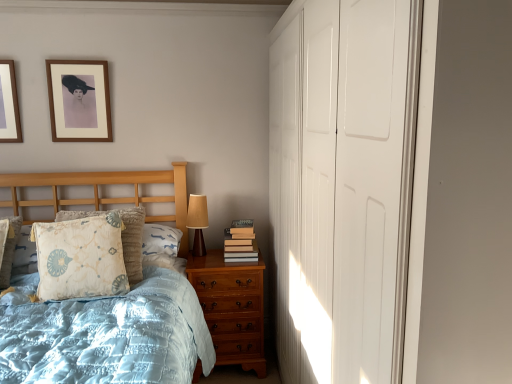
At what (x,y) coordinates should I click in order to perform the action: click on hardcover books at right. Please return your answer as a coordinate pair (x, y). Looking at the image, I should click on (240, 242).

The width and height of the screenshot is (512, 384). In order to click on matte wood picture frame at upper left, which is counted as the second picture frame, starting from the right in this screenshot , I will do `click(9, 105)`.

Consider the image. What is the approximate height of white glossy closet doors at right?

white glossy closet doors at right is 1.96 meters in height.

This screenshot has width=512, height=384. Identify the location of wooden picture frame at upper left, arranged as the 2th picture frame when viewed from the left. (79, 101).

What is the approximate height of floral-patterned fabric pillow at left?

The height of floral-patterned fabric pillow at left is 19.31 inches.

You are a GUI agent. You are given a task and a screenshot of the screen. Output one action in this format:
    pyautogui.click(x=<x>, y=<y>)
    Task: Click on the floral-patterned fabric pillow at left
    This screenshot has width=512, height=384.
    Given the screenshot: What is the action you would take?
    pyautogui.click(x=80, y=258)

Identify the location of hardcover books at right. (240, 242).

From a real-world perspective, between white glossy closet doors at right and hardcover books at right, who is vertically lower?

In real-world perspective, hardcover books at right is lower.

Which object is closer to the camera, white glossy closet doors at right or hardcover books at right?

white glossy closet doors at right is closer to the camera.

Would you say white glossy closet doors at right is a long distance from hardcover books at right?

That's right, there is a large distance between white glossy closet doors at right and hardcover books at right.

Can you confirm if white glossy closet doors at right is shorter than hardcover books at right?

Incorrect, the height of white glossy closet doors at right does not fall short of that of hardcover books at right.

Is light brown wood chest of drawers at lower right bigger or smaller than white glossy closet doors at right?

Considering their sizes, light brown wood chest of drawers at lower right takes up less space than white glossy closet doors at right.

Considering the relative positions of light brown wood chest of drawers at lower right and white glossy closet doors at right in the image provided, is light brown wood chest of drawers at lower right to the left or to the right of white glossy closet doors at right?

From the image, it's evident that light brown wood chest of drawers at lower right is to the left of white glossy closet doors at right.

Are light brown wood chest of drawers at lower right and white glossy closet doors at right beside each other?

No, light brown wood chest of drawers at lower right is not making contact with white glossy closet doors at right.

Which object is closer to the camera taking this photo, white glossy closet doors at right or wooden picture frame at upper left, the first picture frame from the right?

white glossy closet doors at right is more forward.

What's the angular difference between white glossy closet doors at right and wooden picture frame at upper left, the first picture frame from the right,'s facing directions?

→ There is a 90.7-degree angle between the facing directions of white glossy closet doors at right and wooden picture frame at upper left, the first picture frame from the right.

Is white glossy closet doors at right looking in the opposite direction of wooden picture frame at upper left, arranged as the 2th picture frame when viewed from the left?

No, wooden picture frame at upper left, arranged as the 2th picture frame when viewed from the left, is not at the back of white glossy closet doors at right.

From the image's perspective, would you say white glossy closet doors at right is shown under wooden picture frame at upper left, the first picture frame from the right?

Correct, white glossy closet doors at right appears lower than wooden picture frame at upper left, the first picture frame from the right, in the image.

Considering the sizes of white glossy closet doors at right and light blue quilted bed at left in the image, is white glossy closet doors at right bigger or smaller than light blue quilted bed at left?

white glossy closet doors at right is smaller than light blue quilted bed at left.

In the image, there is a light blue quilted bed at left. In order to click on door above it (from the image's perspective) in this screenshot , I will do `click(343, 182)`.

Consider the image. In the image, is white glossy closet doors at right on the left side or the right side of light blue quilted bed at left?

Clearly, white glossy closet doors at right is on the right of light blue quilted bed at left in the image.

Based on the photo, measure the distance from white glossy closet doors at right to light blue quilted bed at left.

A distance of 1.27 meters exists between white glossy closet doors at right and light blue quilted bed at left.

How many degrees apart are the facing directions of wooden picture frame at upper left, arranged as the 2th picture frame when viewed from the left, and light blue quilted bed at left?

1.45e-05 degrees.

Locate an element on the screen. This screenshot has width=512, height=384. bed below the wooden picture frame at upper left, the first picture frame from the right (from the image's perspective) is located at coordinates (106, 198).

From a real-world perspective, is wooden picture frame at upper left, the first picture frame from the right, above or below light blue quilted bed at left?

In terms of real-world spatial position, wooden picture frame at upper left, the first picture frame from the right, is above light blue quilted bed at left.

From the image's perspective, is wooden picture frame at upper left, the first picture frame from the right, above light blue quilted bed at left?

Yes, from the image's perspective, wooden picture frame at upper left, the first picture frame from the right, is on top of light blue quilted bed at left.

From the image's perspective, between light brown wood chest of drawers at lower right and light blue quilted bed at left, which one is located above?

light blue quilted bed at left is shown above in the image.

Is light brown wood chest of drawers at lower right directly adjacent to light blue quilted bed at left?

No, light brown wood chest of drawers at lower right is not with light blue quilted bed at left.

I want to click on chest of drawers lying on the right of light blue quilted bed at left, so click(x=232, y=308).

Which of these two, light brown wood chest of drawers at lower right or light blue quilted bed at left, is bigger?

light blue quilted bed at left is bigger.

From a real-world perspective, is floral-patterned fabric pillow at left positioned over matte brown wood table lamp at right based on gravity?

No.

Considering the relative sizes of floral-patterned fabric pillow at left and matte brown wood table lamp at right in the image provided, is floral-patterned fabric pillow at left bigger than matte brown wood table lamp at right?

Yes.

Considering the positions of point (104, 234) and point (196, 203), is point (104, 234) closer or farther from the camera than point (196, 203)?

Point (104, 234).

This screenshot has width=512, height=384. I want to click on door on the right of hardcover books at right, so 343,182.

At what (x,y) coordinates should I click in order to perform the action: click on the chest of drawers below the white glossy closet doors at right (from a real-world perspective). Please return your answer as a coordinate pair (x, y). Looking at the image, I should click on (232, 308).

From the image, which object appears to be farther from light blue quilted bed at left, floral-patterned fabric pillow at left or hardcover books at right?

The object further to light blue quilted bed at left is hardcover books at right.

Considering their positions, is hardcover books at right positioned further to light brown wood chest of drawers at lower right than floral-patterned fabric pillow at left?

floral-patterned fabric pillow at left lies further to light brown wood chest of drawers at lower right than the other object.

Looking at the image, which one is located further to matte brown wood table lamp at right, matte wood picture frame at upper left, which is counted as the second picture frame, starting from the right, or light brown wood chest of drawers at lower right?

matte wood picture frame at upper left, which is counted as the second picture frame, starting from the right.

Which object lies nearer to the anchor point hardcover books at right, matte wood picture frame at upper left, acting as the 1th picture frame starting from the left, or matte brown wood table lamp at right?

Among the two, matte brown wood table lamp at right is located nearer to hardcover books at right.

Estimate the real-world distances between objects in this image. Which object is further from matte brown wood table lamp at right, white glossy closet doors at right or wooden picture frame at upper left, the first picture frame from the right?

white glossy closet doors at right is positioned further to the anchor matte brown wood table lamp at right.

Looking at the image, which one is located further to white glossy closet doors at right, wooden picture frame at upper left, the first picture frame from the right, or matte wood picture frame at upper left, acting as the 1th picture frame starting from the left?

matte wood picture frame at upper left, acting as the 1th picture frame starting from the left.

Based on the photo, when comparing their distances from wooden picture frame at upper left, arranged as the 2th picture frame when viewed from the left, does hardcover books at right or white glossy closet doors at right seem further?

white glossy closet doors at right lies further to wooden picture frame at upper left, arranged as the 2th picture frame when viewed from the left, than the other object.

Which object lies nearer to the anchor point wooden picture frame at upper left, the first picture frame from the right, white glossy closet doors at right or floral-patterned fabric pillow at left?

The object closer to wooden picture frame at upper left, the first picture frame from the right, is floral-patterned fabric pillow at left.

Image resolution: width=512 pixels, height=384 pixels. Find the location of `book between wooden picture frame at upper left, arranged as the 2th picture frame when viewed from the left, and light brown wood chest of drawers at lower right in the up-down direction`. book between wooden picture frame at upper left, arranged as the 2th picture frame when viewed from the left, and light brown wood chest of drawers at lower right in the up-down direction is located at coordinates (240, 242).

Locate an element on the screen. The height and width of the screenshot is (384, 512). book located between white glossy closet doors at right and matte brown wood table lamp at right in the depth direction is located at coordinates (240, 242).

Find the location of `chest of drawers between light blue quilted bed at left and matte brown wood table lamp at right from front to back`. chest of drawers between light blue quilted bed at left and matte brown wood table lamp at right from front to back is located at coordinates (232, 308).

Find the location of a particular element. The height and width of the screenshot is (384, 512). chest of drawers between light blue quilted bed at left and matte wood picture frame at upper left, which is counted as the second picture frame, starting from the right, along the z-axis is located at coordinates (232, 308).